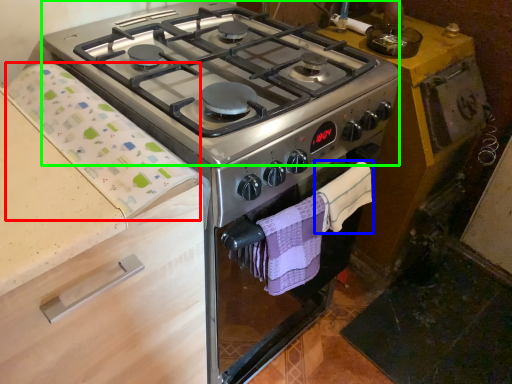
Question: Considering the real-world distances, which object is closest to blanket (highlighted by a red box)? hand towel (highlighted by a blue box) or gas stove (highlighted by a green box).

Choices:
 (A) hand towel
 (B) gas stove

Answer: (B)